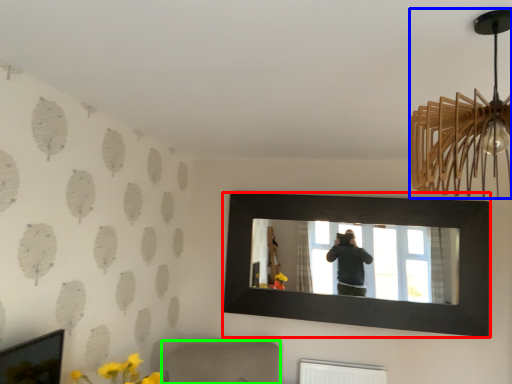
Question: Based on their relative distances, which object is farther from picture frame (highlighted by a red box)? Choose from lamp (highlighted by a blue box) and furniture (highlighted by a green box).

Choices:
 (A) lamp
 (B) furniture

Answer: (A)